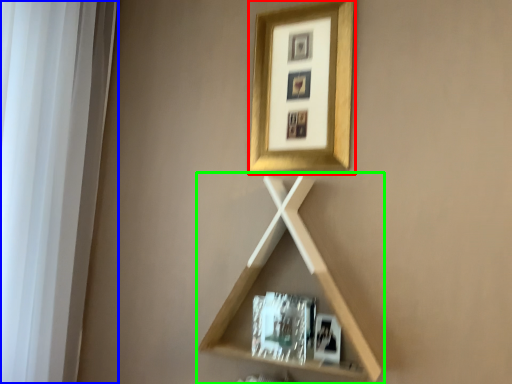
Question: Which is nearer to the picture frame (highlighted by a red box)? window frame (highlighted by a blue box) or shelf (highlighted by a green box).

Choices:
 (A) window frame
 (B) shelf

Answer: (B)